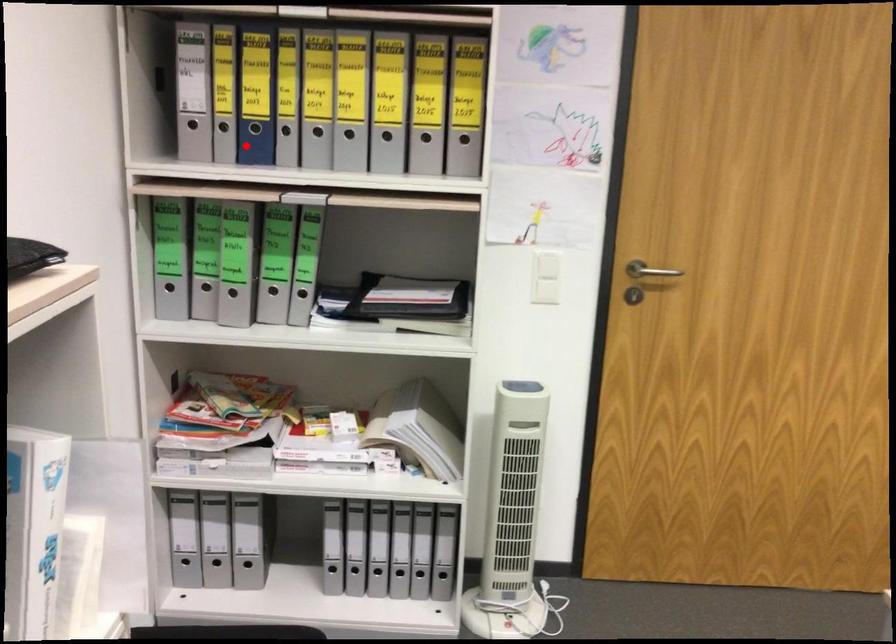
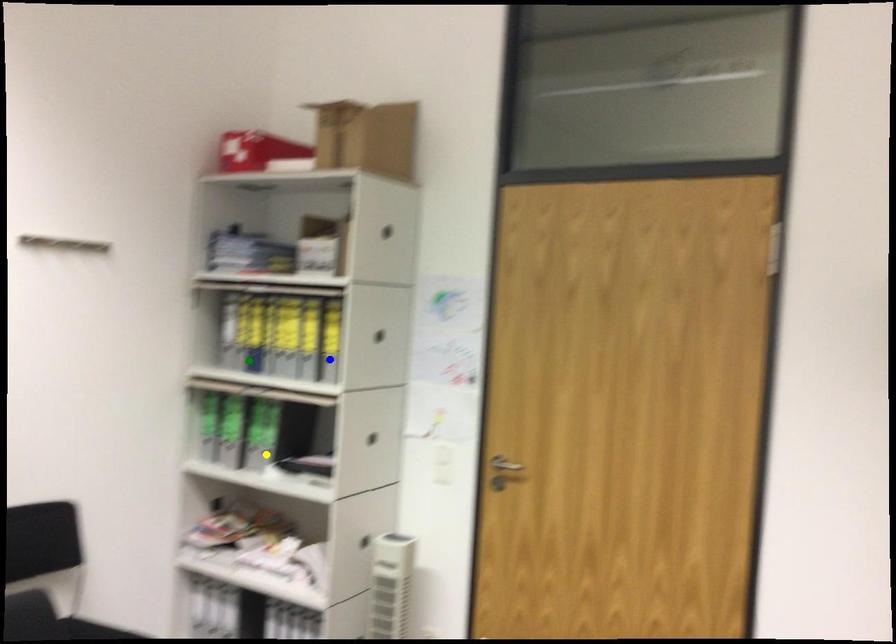
Question: I am providing you with two images of the same scene from different viewpoints. A red point is marked on the first image. You are given multiple points on the second image. Which point in image 2 is actually the same real-world point as the red point in image 1?

Choices:
 (A) green point
 (B) yellow point
 (C) blue point

Answer: (A)